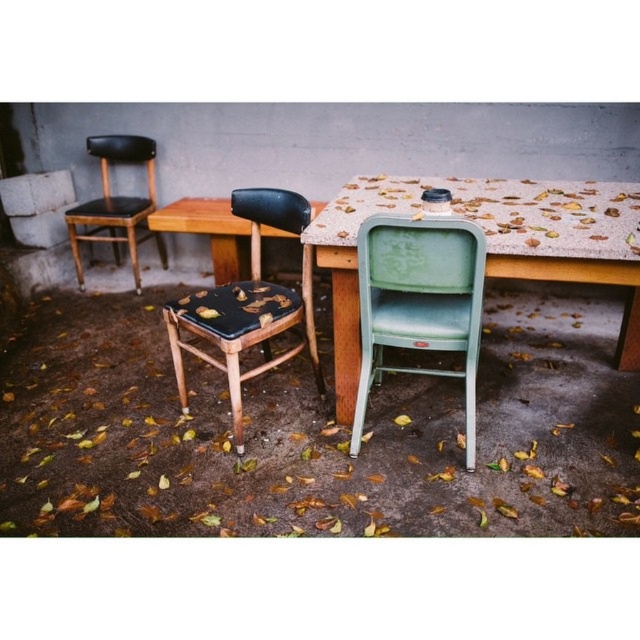
Question: Among these objects, which one is farthest from the camera?

Choices:
 (A) matte black chair at left
 (B) matte black seat at center
 (C) speckled concrete table at center

Answer: (A)

Question: Is speckled concrete table at center thinner than green matte folding chair at center?

Choices:
 (A) no
 (B) yes

Answer: (A)

Question: Is speckled concrete table at center thinner than green matte folding chair at center?

Choices:
 (A) yes
 (B) no

Answer: (B)

Question: Based on their relative distances, which object is nearer to the green matte folding chair at center?

Choices:
 (A) matte black seat at center
 (B) matte black chair at left

Answer: (A)

Question: Among these objects, which one is farthest from the camera?

Choices:
 (A) green matte folding chair at center
 (B) matte black chair at left
 (C) matte black seat at center
 (D) speckled concrete table at center

Answer: (B)

Question: Does speckled concrete table at center have a larger size compared to green matte folding chair at center?

Choices:
 (A) no
 (B) yes

Answer: (B)